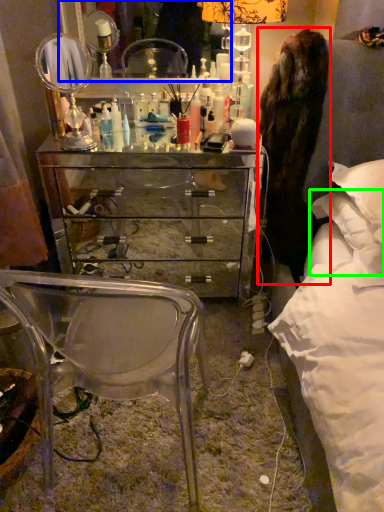
Question: Which is nearer to the fur coat (highlighted by a red box)? mirror (highlighted by a blue box) or pillow (highlighted by a green box).

Choices:
 (A) mirror
 (B) pillow

Answer: (B)